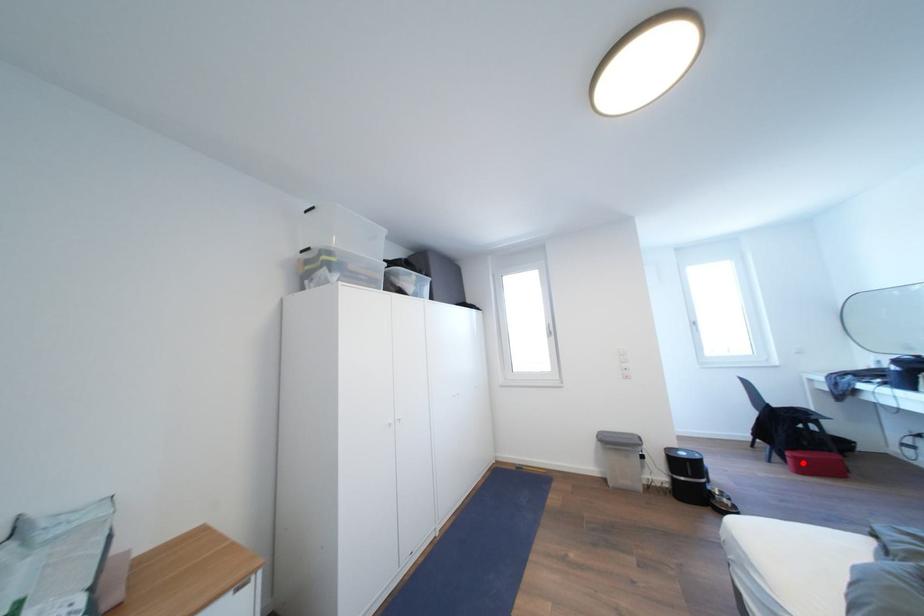
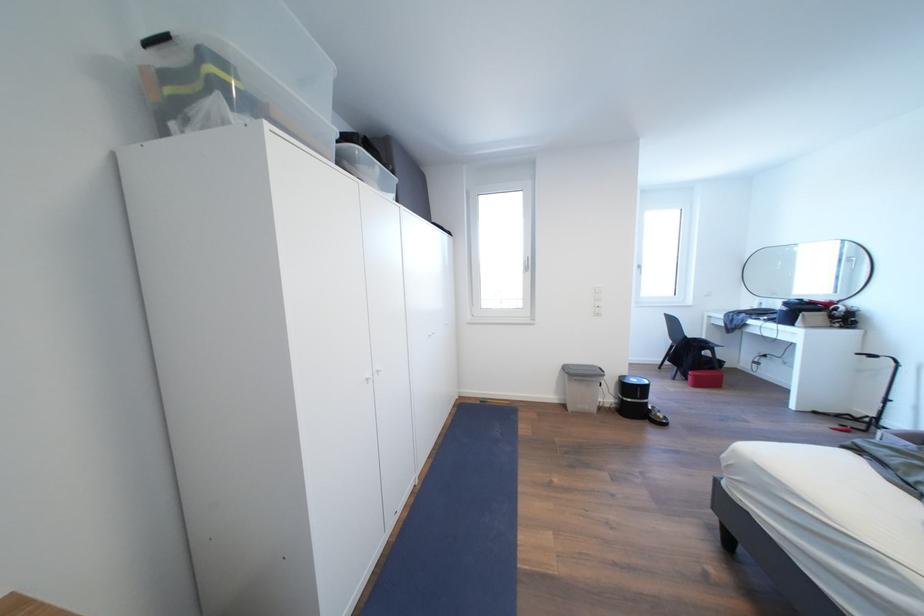
Locate, in the second image, the point that corresponds to the highlighted location in the first image.

(703, 381)